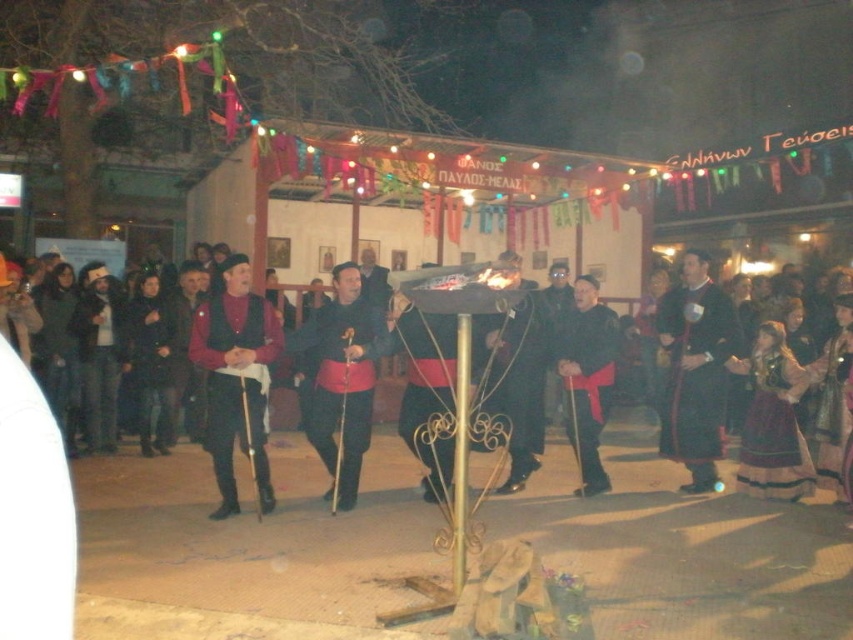
Question: Which object appears farthest from the camera in this image?

Choices:
 (A) matte black robe at center
 (B) black velvet robe at center
 (C) dark clothing crowd at center
 (D) velvet dark blue robe at center

Answer: (D)

Question: Does dark clothing crowd at center appear on the right side of matte black robe at center?

Choices:
 (A) yes
 (B) no

Answer: (B)

Question: Among these points, which one is farthest from the camera?

Choices:
 (A) (289, 339)
 (B) (676, 291)
 (C) (614, 324)
 (D) (689, 321)

Answer: (B)

Question: Is dark clothing crowd at center further to camera compared to velvet dark blue robe at center?

Choices:
 (A) no
 (B) yes

Answer: (A)

Question: Estimate the real-world distances between objects in this image. Which object is closer to the velvet dark blue robe at center?

Choices:
 (A) matte black vest at center
 (B) dark clothing crowd at center

Answer: (B)

Question: Is matte black robe at center positioned in front of black velvet robe at center?

Choices:
 (A) yes
 (B) no

Answer: (A)